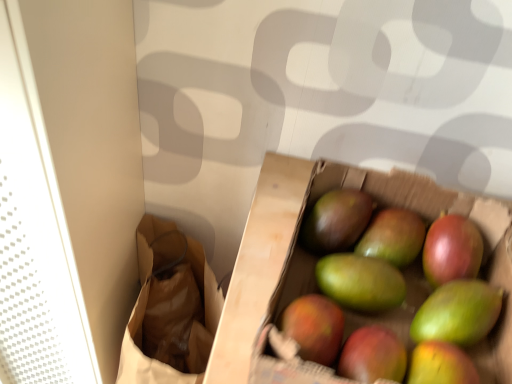
Question: Is green matte mango at center bigger than green matte mango at center?

Choices:
 (A) yes
 (B) no

Answer: (B)

Question: From a real-world perspective, is green matte mango at center physically above green matte mango at center?

Choices:
 (A) yes
 (B) no

Answer: (B)

Question: Considering the relative sizes of green matte mango at center and green matte mango at center in the image provided, is green matte mango at center wider than green matte mango at center?

Choices:
 (A) yes
 (B) no

Answer: (A)

Question: Is green matte mango at center looking in the opposite direction of green matte mango at center?

Choices:
 (A) yes
 (B) no

Answer: (B)

Question: Is green matte mango at center outside of green matte mango at center?

Choices:
 (A) yes
 (B) no

Answer: (A)

Question: Can you confirm if green matte mango at center is thinner than green matte mango at center?

Choices:
 (A) yes
 (B) no

Answer: (B)

Question: From the image's perspective, is green matte mango at center below brown paper bag at left?

Choices:
 (A) yes
 (B) no

Answer: (B)

Question: Considering the relative sizes of green matte mango at center and brown paper bag at left in the image provided, is green matte mango at center taller than brown paper bag at left?

Choices:
 (A) yes
 (B) no

Answer: (B)

Question: Does green matte mango at center have a greater width compared to brown paper bag at left?

Choices:
 (A) no
 (B) yes

Answer: (A)

Question: Is green matte mango at center smaller than brown paper bag at left?

Choices:
 (A) yes
 (B) no

Answer: (A)

Question: Is green matte mango at center positioned with its back to brown paper bag at left?

Choices:
 (A) yes
 (B) no

Answer: (B)

Question: Is green matte mango at center closer to the viewer compared to brown paper bag at left?

Choices:
 (A) no
 (B) yes

Answer: (B)

Question: Considering the relative positions of brown paper bag at left and green matte mango at center in the image provided, is brown paper bag at left to the right of green matte mango at center from the viewer's perspective?

Choices:
 (A) no
 (B) yes

Answer: (A)